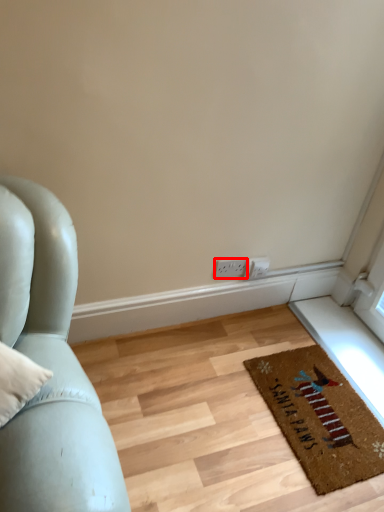
Question: From the image's perspective, considering the relative positions of electric outlet (annotated by the red box) and mat in the image provided, where is electric outlet (annotated by the red box) located with respect to the staircase?

Choices:
 (A) below
 (B) above

Answer: (B)